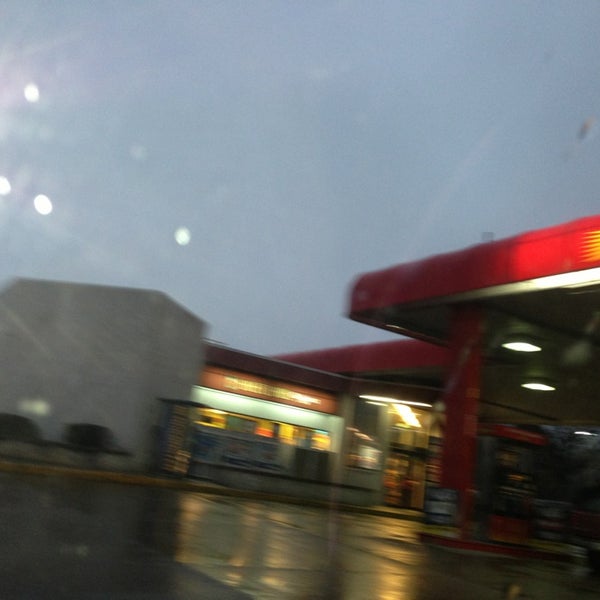
I want to click on light, so point(583,432).